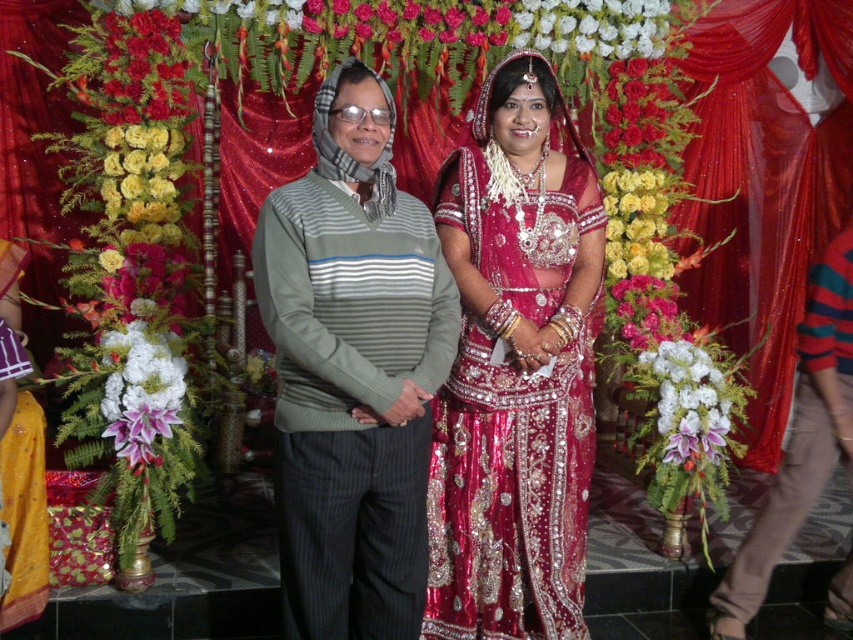
Which is above, white matte flowers at center or yellow silk flowers at left?

yellow silk flowers at left is higher up.

Image resolution: width=853 pixels, height=640 pixels. What are the coordinates of `white matte flowers at center` in the screenshot? It's located at (689, 404).

At what (x,y) coordinates should I click in order to perform the action: click on white matte flowers at center. Please return your answer as a coordinate pair (x, y). This screenshot has width=853, height=640. Looking at the image, I should click on (689, 404).

Between shiny silk lehenga at center and white silk flower at center, which one has less height?

With less height is white silk flower at center.

Can you confirm if shiny silk lehenga at center is positioned to the right of white silk flower at center?

Indeed, shiny silk lehenga at center is positioned on the right side of white silk flower at center.

Is point (505, 246) positioned in front of point (103, 355)?

Yes, it is in front of point (103, 355).

Where is `shiny silk lehenga at center`? The width and height of the screenshot is (853, 640). shiny silk lehenga at center is located at coordinates (514, 408).

The height and width of the screenshot is (640, 853). Describe the element at coordinates (352, 369) in the screenshot. I see `shiny silk saree at center` at that location.

Image resolution: width=853 pixels, height=640 pixels. What do you see at coordinates (352, 369) in the screenshot?
I see `shiny silk saree at center` at bounding box center [352, 369].

Image resolution: width=853 pixels, height=640 pixels. What are the coordinates of `shiny silk saree at center` in the screenshot? It's located at (352, 369).